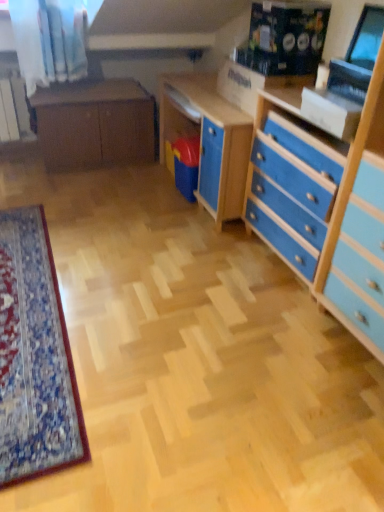
Question: In terms of width, does blue painted wood chest of drawers at right look wider or thinner when compared to matte brown cabinet at center?

Choices:
 (A) wide
 (B) thin

Answer: (B)

Question: From the image's perspective, is blue painted wood chest of drawers at right located above or below matte brown cabinet at center?

Choices:
 (A) below
 (B) above

Answer: (A)

Question: Estimate the real-world distances between objects in this image. Which object is closer to the matte brown cabinet at center?

Choices:
 (A) blue painted wood chest of drawers at right
 (B) matte black monitor at upper right

Answer: (A)

Question: Which object is the farthest from the matte black monitor at upper right?

Choices:
 (A) matte brown cabinet at center
 (B) blue painted wood chest of drawers at right

Answer: (A)